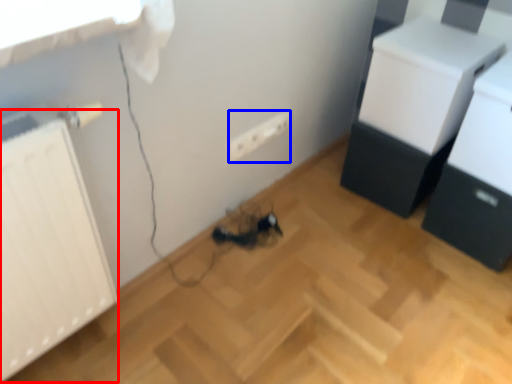
Question: Which of the following is the closest to the observer, radiator (highlighted by a red box) or electric outlet (highlighted by a blue box)?

Choices:
 (A) radiator
 (B) electric outlet

Answer: (A)